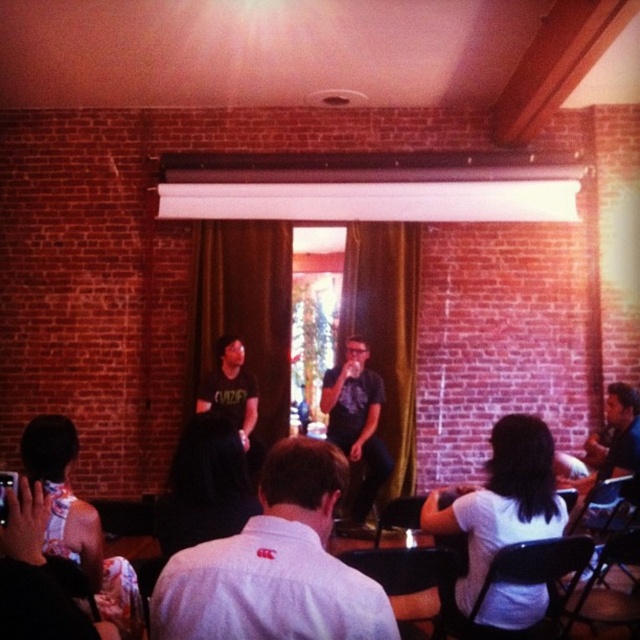
You are a photographer standing at the back of the venue. You want to take a photo of both the white cotton shirt at center and the matte black shirt at center so that they are both clearly visible in the frame. Given that your camera has a maximum focus range of 3 meters, will you be able to capture both subjects in focus without moving closer?

The white cotton shirt at center and the matte black shirt at center are 3.29 meters apart. Since the distance between them exceeds the camera maximum focus range of 3 meters, you will not be able to capture both subjects in focus without moving closer.

You are standing at the point labeled point (x=273, y=516) and want to move towards the point labeled point (x=340, y=444). Which direction should you move to get closer to your destination?

To move from point (x=273, y=516) towards point (x=340, y=444), you should move diagonally upwards and to the left since point (x=340, y=444) is located behind and to the left of point (x=273, y=516).

You are an event planner trying to arrange seating for a photo shoot. You need to place a camera so that both the white cotton shirt at center and the matte black shirt at center are visible. Considering their sizes, which shirt should be placed closer to the camera to ensure both are equally visible in the photo?

The white cotton shirt at center is smaller than the matte black shirt at center. To make both shirts appear equally visible in the photo, the smaller white cotton shirt at center should be placed closer to the camera.